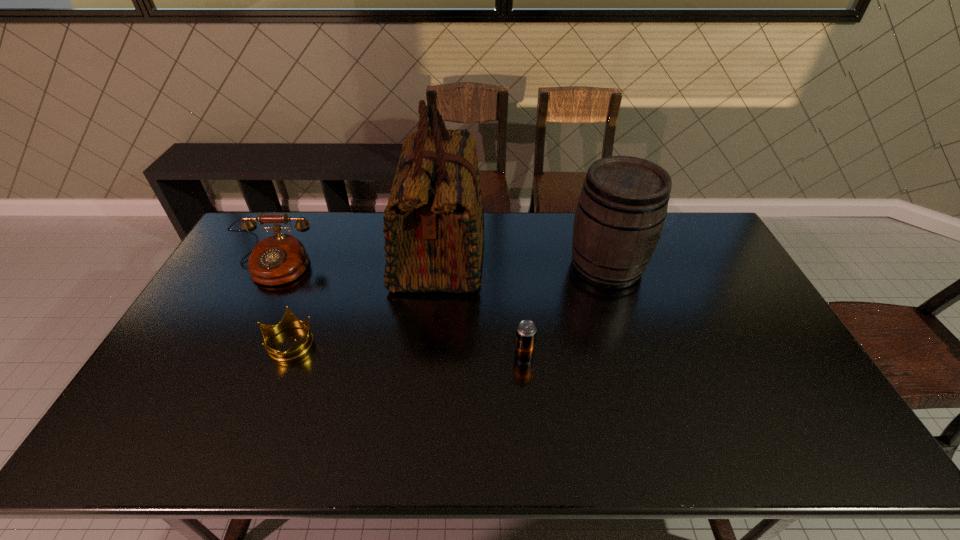
Where is `the tallest object`? This screenshot has height=540, width=960. the tallest object is located at coordinates (433, 224).

At what (x,y) coordinates should I click in order to perform the action: click on shopping bag. Please return your answer as a coordinate pair (x, y). Image resolution: width=960 pixels, height=540 pixels. Looking at the image, I should click on (433, 224).

This screenshot has height=540, width=960. I want to click on the rightmost object, so click(x=622, y=207).

Image resolution: width=960 pixels, height=540 pixels. I want to click on the second tallest object, so pyautogui.click(x=622, y=207).

The width and height of the screenshot is (960, 540). I want to click on telephone, so click(279, 259).

This screenshot has height=540, width=960. I want to click on beer can, so click(526, 331).

Locate an element on the screen. The width and height of the screenshot is (960, 540). the second object from right to left is located at coordinates coord(526,331).

Locate an element on the screen. the shortest object is located at coordinates (289, 320).

This screenshot has height=540, width=960. Find the location of `vacant region located on the open handle side of the third object from right to left`. vacant region located on the open handle side of the third object from right to left is located at coordinates (552, 252).

Locate an element on the screen. vacant area located 0.120m on the right of the wine bucket is located at coordinates (682, 265).